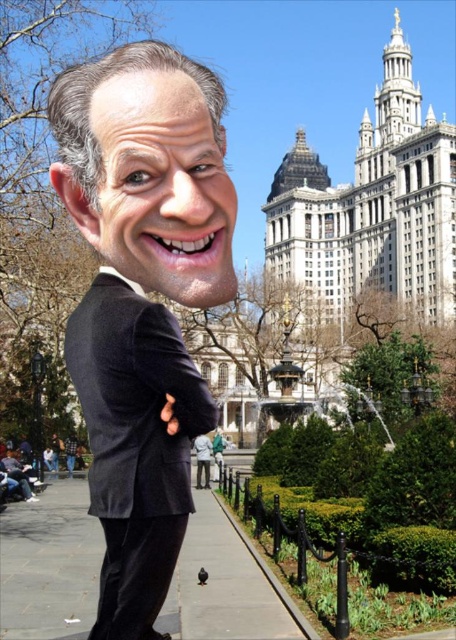
Describe the element at coordinates (134, 445) in the screenshot. I see `black velvet suit at left` at that location.

Between black velvet suit at left and matte black suit at center, which one is positioned lower?

matte black suit at center is below.

Is point (138, 488) positioned after point (3, 468)?

No, it is not.

Identify the location of black velvet suit at left. point(134,445).

Can you confirm if black matte suit at center is bigger than black velvet suit at left?

Yes.

Does black matte suit at center have a lesser height compared to black velvet suit at left?

Incorrect, black matte suit at center's height does not fall short of black velvet suit at left's.

Where is `black matte suit at center`? black matte suit at center is located at coordinates pos(143,300).

Identify the location of black matte suit at center. (143, 300).

Which is behind, point (170, 220) or point (36, 497)?

Point (36, 497)

What do you see at coordinates (143, 300) in the screenshot?
I see `black matte suit at center` at bounding box center [143, 300].

Where is `black matte suit at center`? black matte suit at center is located at coordinates (143, 300).